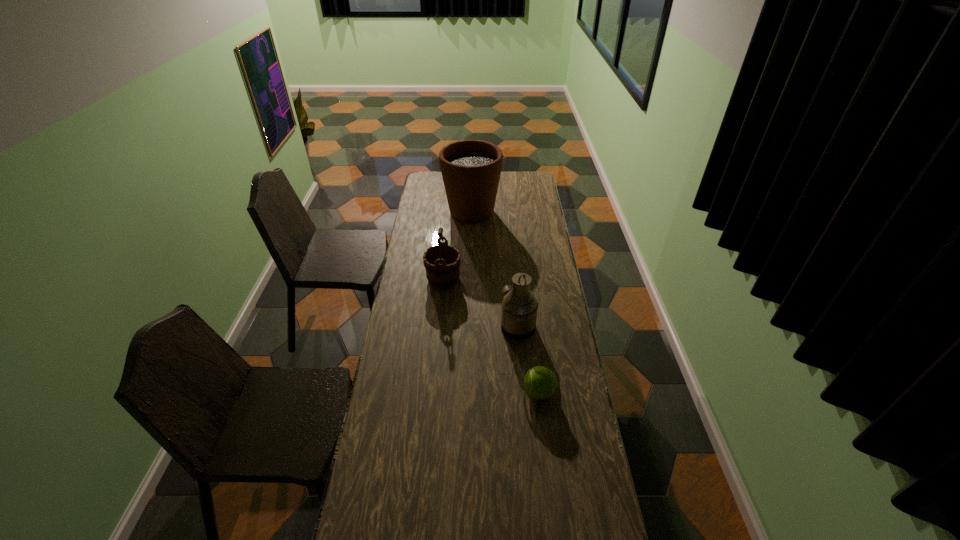
Where is `flowerpot at the left edge`? flowerpot at the left edge is located at coordinates (471, 169).

You are a GUI agent. You are given a task and a screenshot of the screen. Output one action in this format:
    pyautogui.click(x=<x>, y=<y>)
    Task: Click on the wine bucket at the left edge
    
    Given the screenshot: What is the action you would take?
    pyautogui.click(x=442, y=262)

Find the location of a particular element. This screenshot has width=960, height=540. pitcher positioned at the right edge is located at coordinates (519, 306).

This screenshot has width=960, height=540. Identify the location of tennis ball present at the right edge. (540, 383).

In the image, there is a desktop. Identify the location of blank space at the far edge. The height and width of the screenshot is (540, 960). (506, 190).

The width and height of the screenshot is (960, 540). In order to click on vacant space at the left edge in this screenshot , I will do `click(443, 203)`.

In the image, there is a desktop. Identify the location of vacant space at the right edge. Image resolution: width=960 pixels, height=540 pixels. (566, 320).

The width and height of the screenshot is (960, 540). What are the coordinates of `free space between the flowerpot and the second farthest object` in the screenshot? It's located at (458, 246).

What are the coordinates of `free spot between the pitcher and the flowerpot` in the screenshot? It's located at (494, 269).

At what (x,y) coordinates should I click in order to perform the action: click on free point between the second farthest object and the pitcher. Please return your answer as a coordinate pair (x, y). This screenshot has height=540, width=960. Looking at the image, I should click on (480, 303).